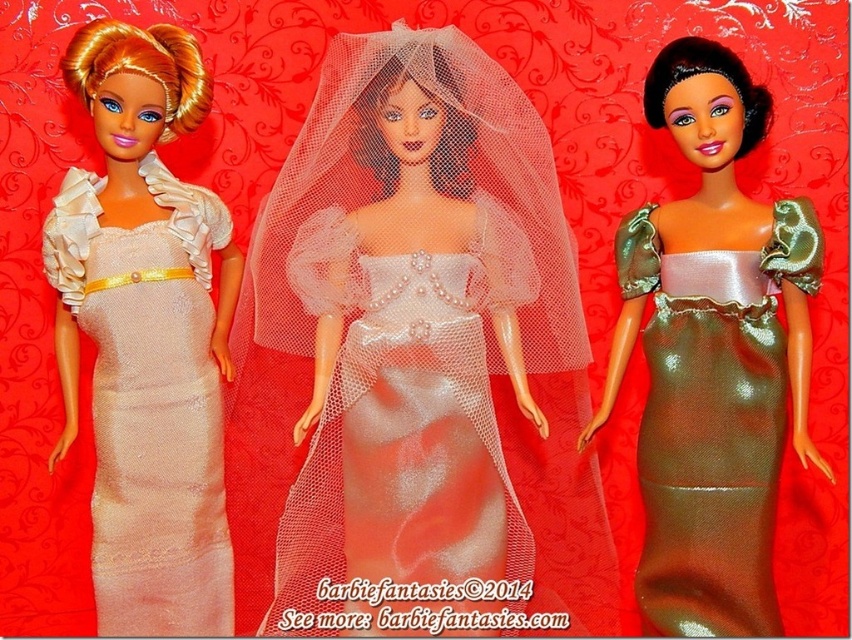
Does matte cream dress at center appear under shiny gold dress at center?

No.

Describe the element at coordinates (147, 333) in the screenshot. The width and height of the screenshot is (852, 640). I see `matte cream dress at center` at that location.

Who is more distant from viewer, (188, 433) or (607, 385)?

The point (607, 385) is more distant.

Identify the location of matte cream dress at center. The image size is (852, 640). (147, 333).

Is pearl white satin dress at center thinner than shiny gold dress at center?

In fact, pearl white satin dress at center might be wider than shiny gold dress at center.

Is point (522, 397) positioned in front of point (677, 493)?

Yes.

Which is behind, point (502, 204) or point (707, 522)?

Point (502, 204)

Where is `pearl white satin dress at center`? This screenshot has width=852, height=640. pearl white satin dress at center is located at coordinates (430, 336).

Can you confirm if pearl white satin dress at center is taller than matte cream dress at center?

Indeed, pearl white satin dress at center has a greater height compared to matte cream dress at center.

Is pearl white satin dress at center to the left of matte cream dress at center from the viewer's perspective?

No, pearl white satin dress at center is not to the left of matte cream dress at center.

Between point (418, 544) and point (119, 488), which one is positioned behind?

The point (119, 488) is behind.

The image size is (852, 640). In order to click on pearl white satin dress at center in this screenshot , I will do `click(430, 336)`.